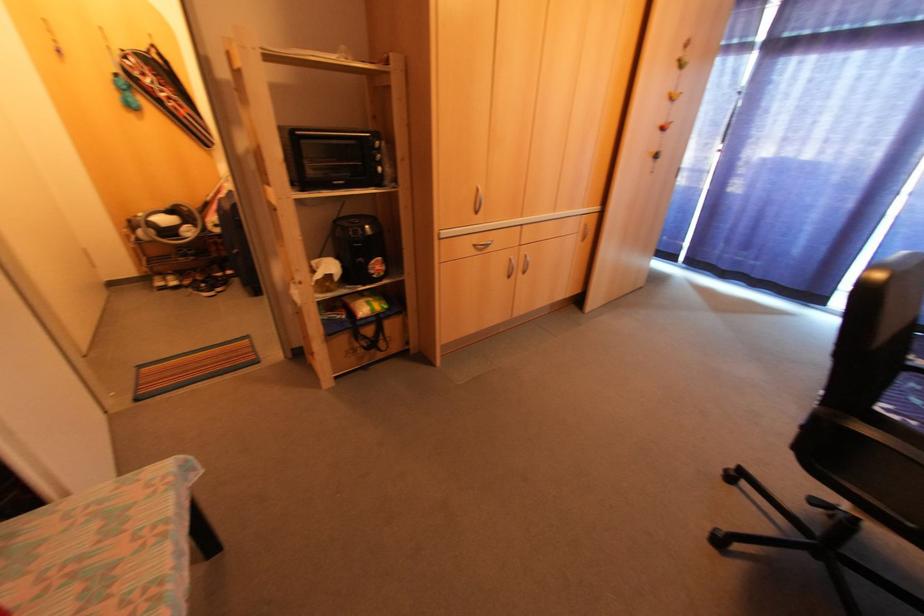
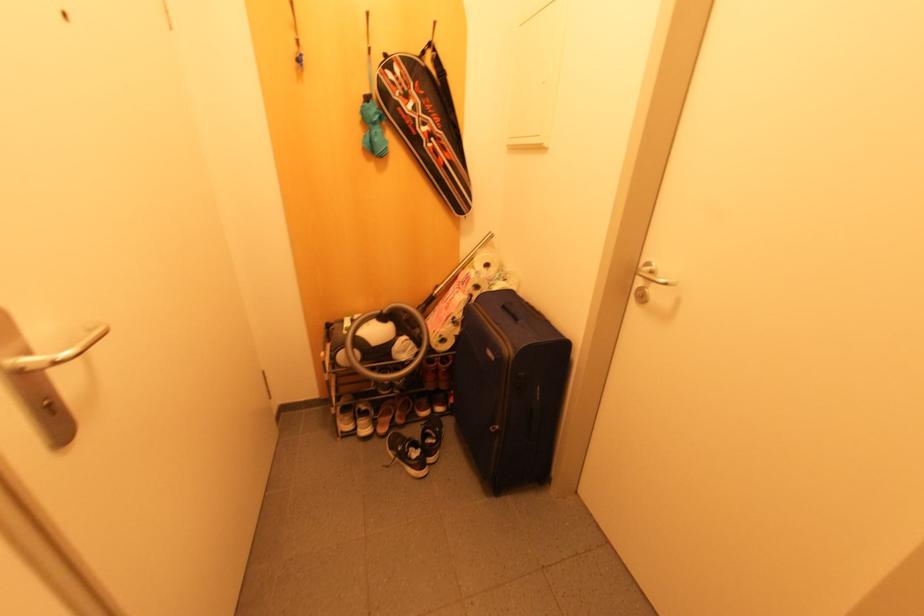
In a continuous first-person perspective shot, in which direction is the camera moving?

The cameraman walked toward left, forward.